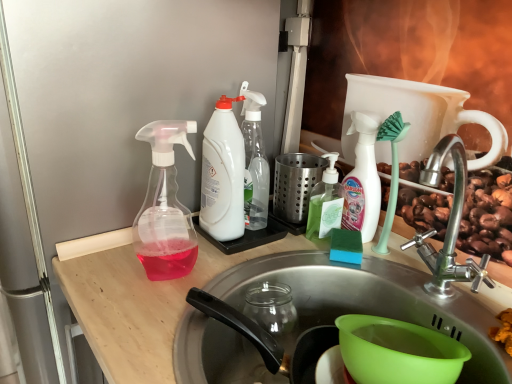
Question: Considering the relative sizes of white plastic bottle at center, arranged as the 2th bottle when viewed from the left, and transparent plastic spray bottle at left, acting as the 5th bottle starting from the right, in the image provided, is white plastic bottle at center, arranged as the 2th bottle when viewed from the left, shorter than transparent plastic spray bottle at left, acting as the 5th bottle starting from the right,?

Choices:
 (A) yes
 (B) no

Answer: (B)

Question: Are white plastic bottle at center, arranged as the 2th bottle when viewed from the left, and transparent plastic spray bottle at left, the first bottle when ordered from left to right, far apart?

Choices:
 (A) yes
 (B) no

Answer: (B)

Question: Is white plastic bottle at center, arranged as the 4th bottle when viewed from the right, taller than transparent plastic spray bottle at left, the first bottle when ordered from left to right?

Choices:
 (A) yes
 (B) no

Answer: (A)

Question: Is white plastic bottle at center, arranged as the 2th bottle when viewed from the left, to the left of transparent plastic spray bottle at left, the first bottle when ordered from left to right, from the viewer's perspective?

Choices:
 (A) no
 (B) yes

Answer: (A)

Question: Is white plastic bottle at center, arranged as the 2th bottle when viewed from the left, surrounding transparent plastic spray bottle at left, the first bottle when ordered from left to right?

Choices:
 (A) yes
 (B) no

Answer: (B)

Question: From a real-world perspective, relative to stainless steel sink at center, is transparent plastic spray bottle at left, acting as the 5th bottle starting from the right, vertically above or below?

Choices:
 (A) above
 (B) below

Answer: (A)

Question: Considering the positions of point (157, 163) and point (450, 235), is point (157, 163) closer or farther from the camera than point (450, 235)?

Choices:
 (A) farther
 (B) closer

Answer: (B)

Question: Considering the relative positions of transparent plastic spray bottle at left, the first bottle when ordered from left to right, and stainless steel sink at center in the image provided, is transparent plastic spray bottle at left, the first bottle when ordered from left to right, to the left or to the right of stainless steel sink at center?

Choices:
 (A) left
 (B) right

Answer: (A)

Question: Considering the positions of transparent plastic spray bottle at left, the first bottle when ordered from left to right, and stainless steel sink at center in the image, is transparent plastic spray bottle at left, the first bottle when ordered from left to right, taller or shorter than stainless steel sink at center?

Choices:
 (A) short
 (B) tall

Answer: (A)

Question: From a real-world perspective, is white plastic spray bottle at center, which is the 3th bottle from left to right, positioned above or below stainless steel sink at center?

Choices:
 (A) above
 (B) below

Answer: (A)

Question: Do you think white plastic spray bottle at center, which is counted as the 3th bottle, starting from the right, is within stainless steel sink at center, or outside of it?

Choices:
 (A) inside
 (B) outside

Answer: (B)

Question: From their relative heights in the image, would you say white plastic spray bottle at center, which is counted as the 3th bottle, starting from the right, is taller or shorter than stainless steel sink at center?

Choices:
 (A) tall
 (B) short

Answer: (B)

Question: From the image's perspective, relative to stainless steel sink at center, is white plastic spray bottle at center, which is counted as the 3th bottle, starting from the right, above or below?

Choices:
 (A) below
 (B) above

Answer: (B)

Question: Does point (338, 206) appear closer or farther from the camera than point (260, 140)?

Choices:
 (A) closer
 (B) farther

Answer: (A)

Question: From the image's perspective, is green translucent soap dispenser at center, which is the fourth bottle in left-to-right order, positioned above or below white plastic spray bottle at center, which is the 3th bottle from left to right?

Choices:
 (A) below
 (B) above

Answer: (A)